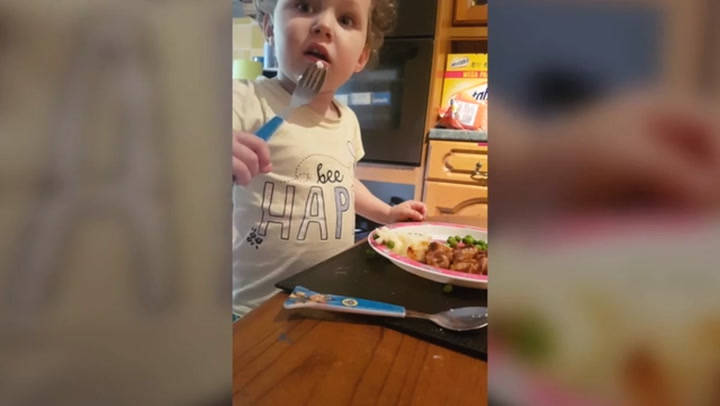
At what (x,y) coordinates should I click in order to perform the action: click on plate. Please return your answer as a coordinate pair (x, y). The image size is (720, 406). Looking at the image, I should click on (428, 228).